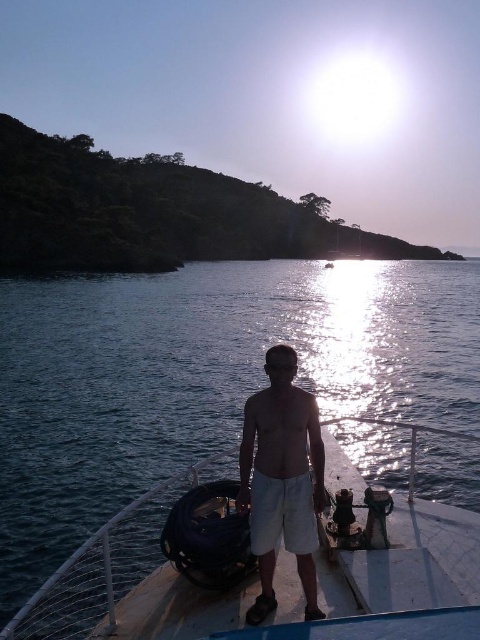
Question: Is the position of blue water at center less distant than that of white cotton shorts at center?

Choices:
 (A) no
 (B) yes

Answer: (B)

Question: Which point appears closest to the camera in this image?

Choices:
 (A) (10, 588)
 (B) (286, 480)

Answer: (B)

Question: Does blue water at center have a greater width compared to white cotton shorts at center?

Choices:
 (A) yes
 (B) no

Answer: (A)

Question: Which point is farther from the camera taking this photo?

Choices:
 (A) (60, 490)
 (B) (294, 547)

Answer: (A)

Question: Can you confirm if blue water at center is positioned to the right of white cotton shorts at center?

Choices:
 (A) no
 (B) yes

Answer: (A)

Question: Which object appears farthest from the camera in this image?

Choices:
 (A) white cotton shorts at center
 (B) blue water at center

Answer: (A)